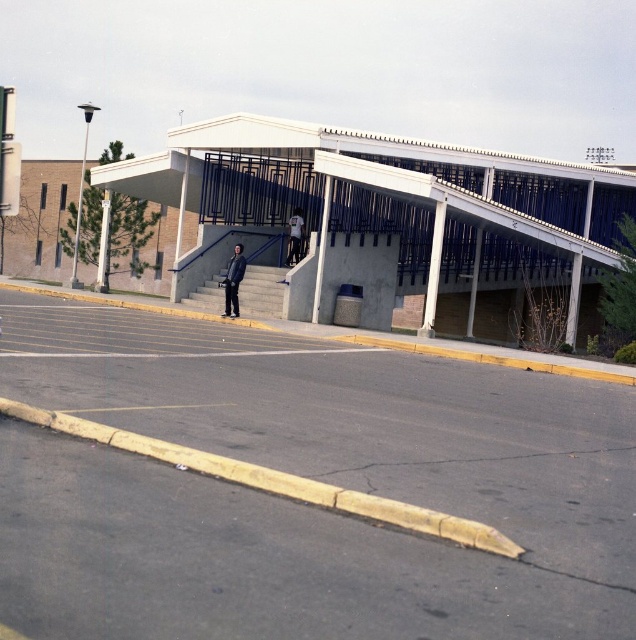
Question: Considering the relative positions of dark blue jacket at center and light blue fabric jacket at center in the image provided, where is dark blue jacket at center located with respect to light blue fabric jacket at center?

Choices:
 (A) left
 (B) right

Answer: (A)

Question: Does dark blue jacket at center appear on the right side of light blue fabric jacket at center?

Choices:
 (A) yes
 (B) no

Answer: (B)

Question: Which point is closer to the camera?

Choices:
 (A) [x=298, y=240]
 (B) [x=232, y=305]

Answer: (B)

Question: Is dark blue jacket at center wider than light blue fabric jacket at center?

Choices:
 (A) yes
 (B) no

Answer: (A)

Question: Which is nearer to the dark blue jacket at center?

Choices:
 (A) light blue fabric jacket at center
 (B) gray asphalt parking lot at center

Answer: (A)

Question: Which object appears closest to the camera in this image?

Choices:
 (A) gray asphalt parking lot at center
 (B) light blue fabric jacket at center
 (C) dark blue jacket at center

Answer: (A)